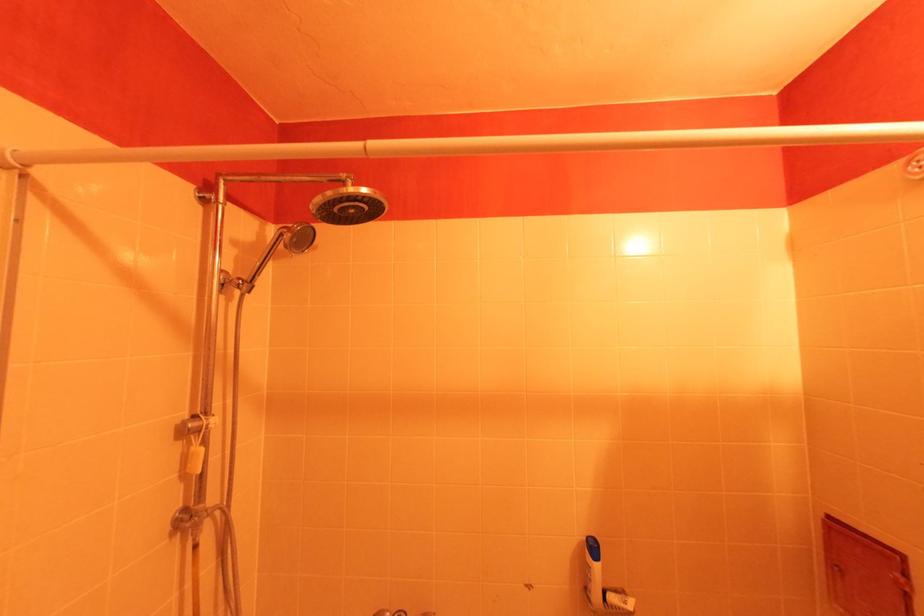
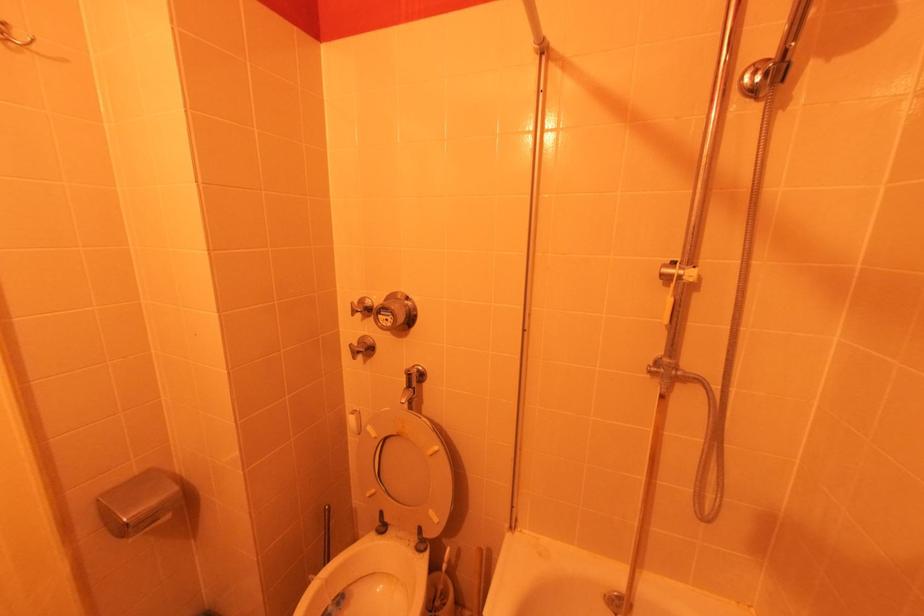
Question: Based on the continuous images, in which direction is the camera rotating? Reply with the corresponding letter.

Choices:
 (A) Left
 (B) Right
 (C) Up
 (D) Down

Answer: (A)